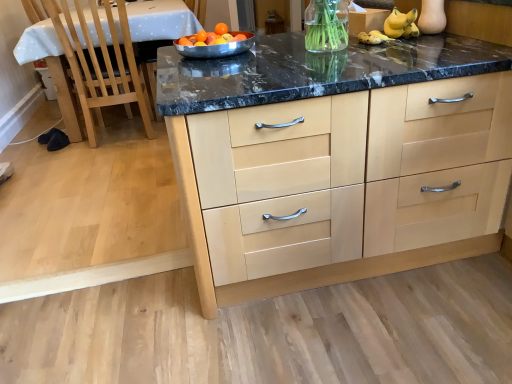
Question: In terms of size, does orange matte at center appear bigger or smaller than white glossy table at left?

Choices:
 (A) small
 (B) big

Answer: (A)

Question: Considering the positions of point (215, 29) and point (56, 67), is point (215, 29) closer or farther from the camera than point (56, 67)?

Choices:
 (A) farther
 (B) closer

Answer: (B)

Question: Which of these objects is positioned farthest from the orange matte at center?

Choices:
 (A) white glossy table at left
 (B) stainless steel bowl at center
 (C) light wood cabinetry at center

Answer: (A)

Question: Which is farther from the stainless steel bowl at center?

Choices:
 (A) light wood cabinetry at center
 (B) orange matte at center
 (C) white glossy table at left

Answer: (C)